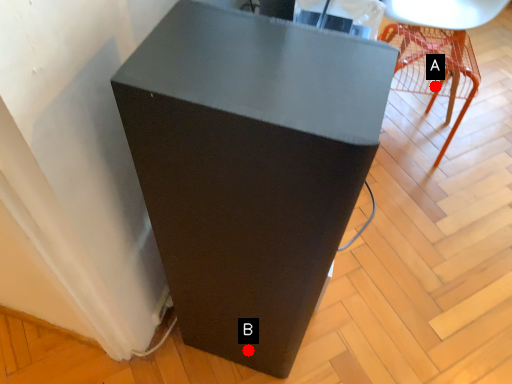
Question: Two points are circled on the image, labeled by A and B beside each circle. Which point is closer to the camera?

Choices:
 (A) A is closer
 (B) B is closer

Answer: (B)